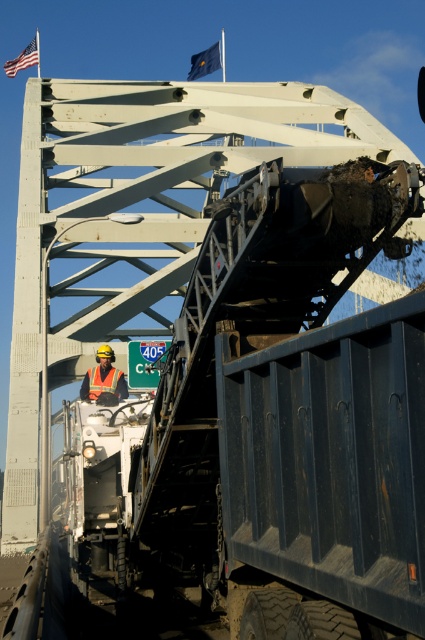
Question: Is orange reflective vest at center further to the viewer compared to orange reflective safety vest at center?

Choices:
 (A) no
 (B) yes

Answer: (A)

Question: Which object is closer to the camera taking this photo?

Choices:
 (A) american flag at upper left
 (B) orange reflective vest at center

Answer: (B)

Question: Does orange reflective vest at center have a lesser width compared to blue fabric flag at upper center?

Choices:
 (A) no
 (B) yes

Answer: (B)

Question: Can you confirm if orange reflective vest at center is positioned below orange reflective safety vest at center?

Choices:
 (A) yes
 (B) no

Answer: (A)

Question: Which point is farther to the camera?

Choices:
 (A) (98, 376)
 (B) (223, 40)
 (C) (37, 61)
 (D) (110, 353)

Answer: (B)

Question: Among these points, which one is farthest from the camera?

Choices:
 (A) (122, 392)
 (B) (8, 72)
 (C) (90, 376)

Answer: (B)